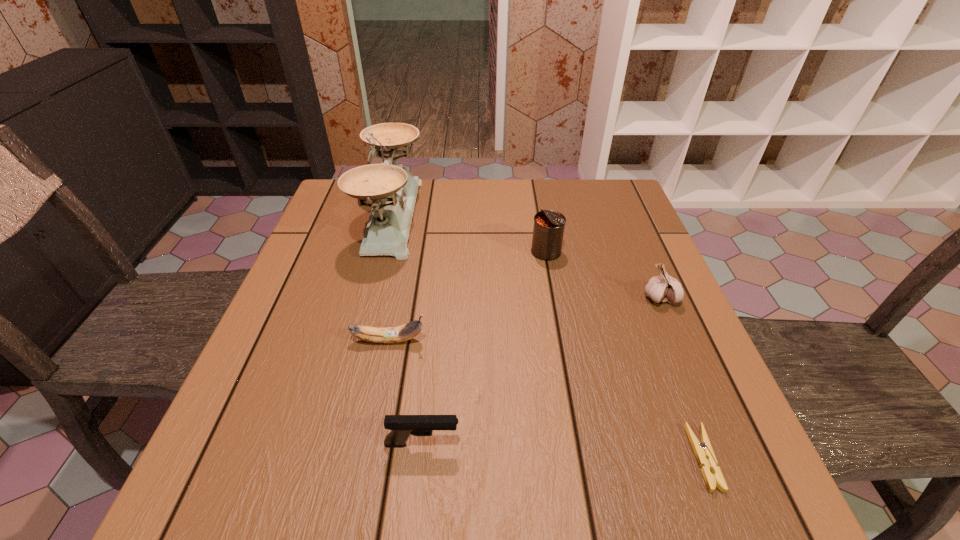
Find the location of a particular element. This screenshot has height=540, width=960. scale is located at coordinates (393, 190).

Locate an element on the screen. This screenshot has height=540, width=960. can is located at coordinates (548, 230).

Locate an element on the screen. This screenshot has width=960, height=540. the third object from right to left is located at coordinates (548, 230).

I want to click on garlic, so click(664, 288).

Image resolution: width=960 pixels, height=540 pixels. Find the location of `banana`. banana is located at coordinates (405, 332).

Where is `pistol`? The height and width of the screenshot is (540, 960). pistol is located at coordinates (402, 426).

The width and height of the screenshot is (960, 540). What are the coordinates of `clothespin` in the screenshot? It's located at (703, 451).

You are a GUI agent. You are given a task and a screenshot of the screen. Output one action in this format:
    pyautogui.click(x=<x>, y=<y>)
    Task: Click on the free space located 0.290m on the front-facing side of the tallest object
    
    Given the screenshot: What is the action you would take?
    pyautogui.click(x=526, y=216)

This screenshot has height=540, width=960. Find the location of `vacant space situated on the back of the second tallest object`. vacant space situated on the back of the second tallest object is located at coordinates (540, 214).

I want to click on blank space located 0.280m on the front of the garlic, so click(716, 429).